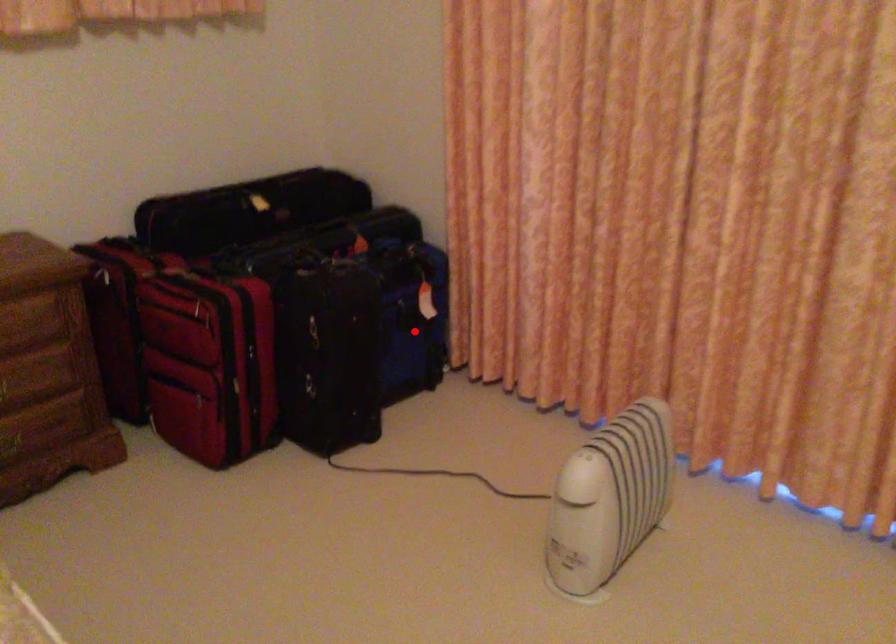
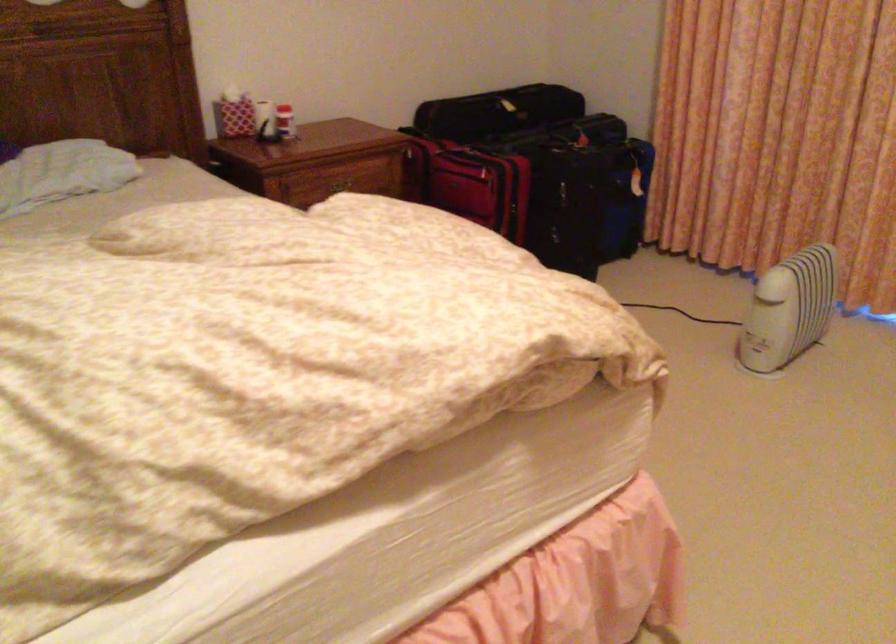
In the second image, find the point that corresponds to the highlighted location in the first image.

(625, 199)